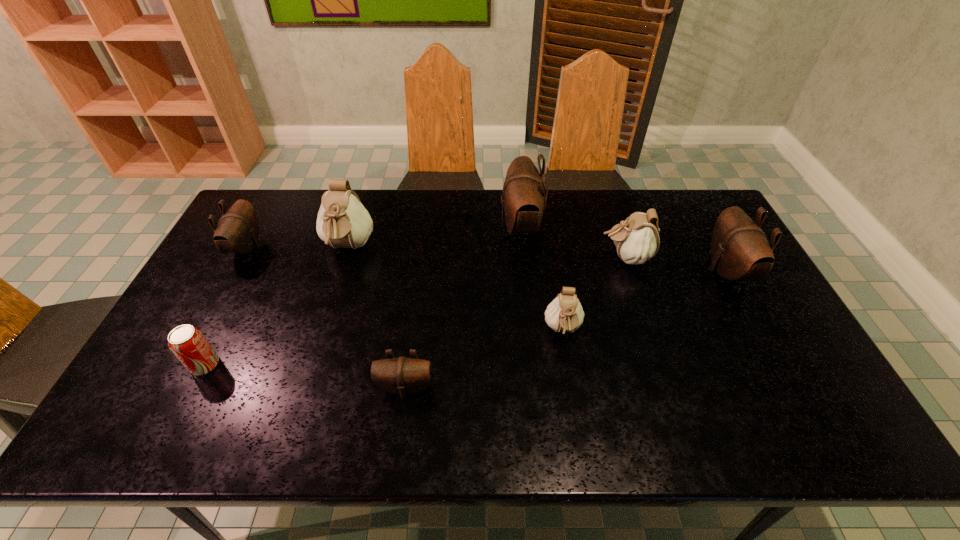
Locate an element on the screen. Image resolution: width=960 pixels, height=540 pixels. object located at the right edge is located at coordinates (739, 248).

Where is `object that is at the far left corner`? This screenshot has width=960, height=540. object that is at the far left corner is located at coordinates (237, 232).

In the image, there is a desktop. Where is `vacant space at the far edge`? The image size is (960, 540). vacant space at the far edge is located at coordinates (411, 208).

In the image, there is a desktop. At what (x,y) coordinates should I click in order to perform the action: click on vacant space at the left edge. Please return your answer as a coordinate pair (x, y). This screenshot has height=540, width=960. Looking at the image, I should click on (240, 291).

Locate an element on the screen. free space at the far right corner is located at coordinates (677, 210).

I want to click on empty space that is in between the fifth object from right to left and the sixth pouch from left to right, so click(x=516, y=322).

Locate an element on the screen. This screenshot has width=960, height=540. free space between the soda can and the rightmost object is located at coordinates 466,318.

This screenshot has width=960, height=540. I want to click on free spot between the third pouch from left to right and the biggest brown pouch, so click(x=463, y=307).

Where is `vacant region between the biggest brown pouch and the leftmost pouch`? Image resolution: width=960 pixels, height=540 pixels. vacant region between the biggest brown pouch and the leftmost pouch is located at coordinates (384, 238).

Find the location of a particular element. This screenshot has height=540, width=960. blank region between the rightmost brown pouch and the leftmost pouch is located at coordinates (487, 259).